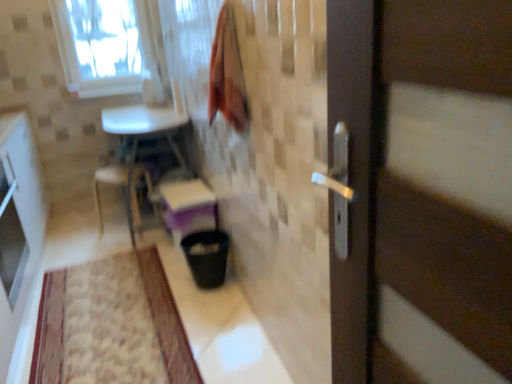
Question: Is white plastic chair at lower left oriented away from black plastic trash can at lower center?

Choices:
 (A) no
 (B) yes

Answer: (A)

Question: Is white plastic chair at lower left not within black plastic trash can at lower center?

Choices:
 (A) yes
 (B) no

Answer: (A)

Question: Is black plastic trash can at lower center surrounded by white plastic chair at lower left?

Choices:
 (A) yes
 (B) no

Answer: (B)

Question: From the image's perspective, does white plastic chair at lower left appear higher than black plastic trash can at lower center?

Choices:
 (A) no
 (B) yes

Answer: (B)

Question: Is white plastic chair at lower left to the right of black plastic trash can at lower center from the viewer's perspective?

Choices:
 (A) yes
 (B) no

Answer: (B)

Question: From a real-world perspective, is black plastic trash can at lower center physically located above or below white glossy cabinet at left?

Choices:
 (A) above
 (B) below

Answer: (B)

Question: Considering their positions, is black plastic trash can at lower center located in front of or behind white glossy cabinet at left?

Choices:
 (A) front
 (B) behind

Answer: (B)

Question: In terms of width, does black plastic trash can at lower center look wider or thinner when compared to white glossy cabinet at left?

Choices:
 (A) thin
 (B) wide

Answer: (B)

Question: Which is correct: black plastic trash can at lower center is inside white glossy cabinet at left, or outside of it?

Choices:
 (A) inside
 (B) outside

Answer: (B)

Question: From the image's perspective, relative to matte white step stool at center, is transparent glass window at upper left above or below?

Choices:
 (A) below
 (B) above

Answer: (B)

Question: From a real-world perspective, is transparent glass window at upper left physically located above or below matte white step stool at center?

Choices:
 (A) below
 (B) above

Answer: (B)

Question: In terms of size, does transparent glass window at upper left appear bigger or smaller than matte white step stool at center?

Choices:
 (A) small
 (B) big

Answer: (B)

Question: Which is correct: transparent glass window at upper left is inside matte white step stool at center, or outside of it?

Choices:
 (A) inside
 (B) outside

Answer: (B)

Question: From the image's perspective, relative to transparent glass window at upper left, is white glossy cabinet at left above or below?

Choices:
 (A) below
 (B) above

Answer: (A)

Question: Considering their positions, is white glossy cabinet at left located in front of or behind transparent glass window at upper left?

Choices:
 (A) front
 (B) behind

Answer: (A)